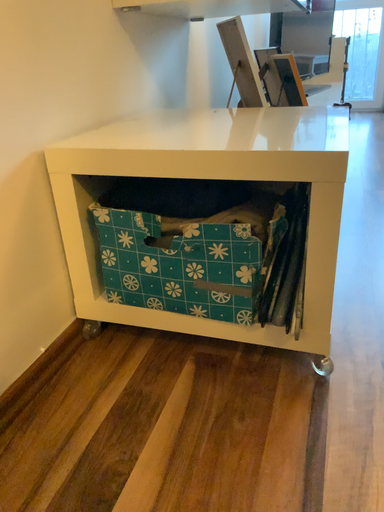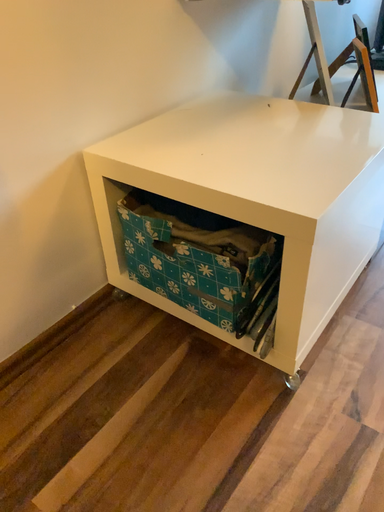
Question: How did the camera likely rotate when shooting the video?

Choices:
 (A) rotated right
 (B) rotated left

Answer: (B)